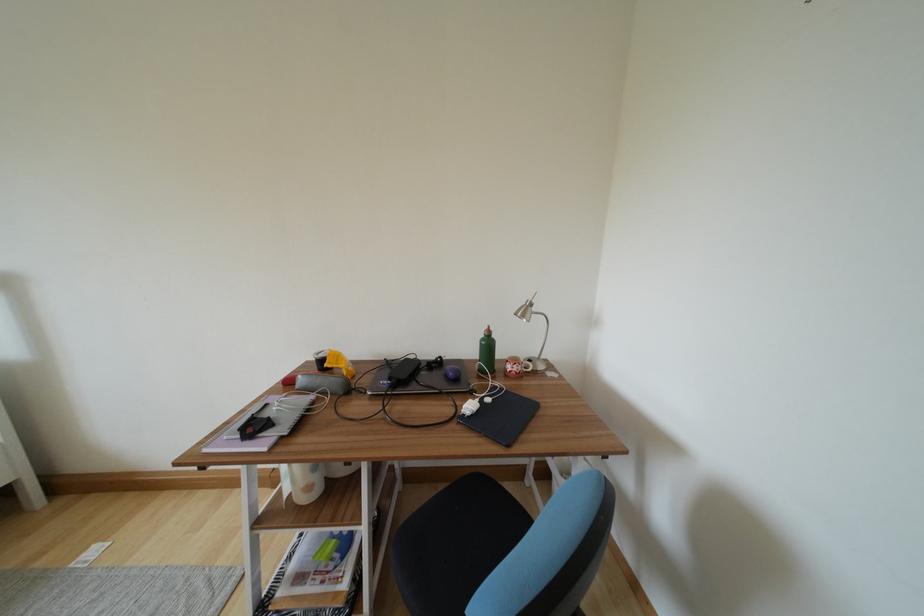
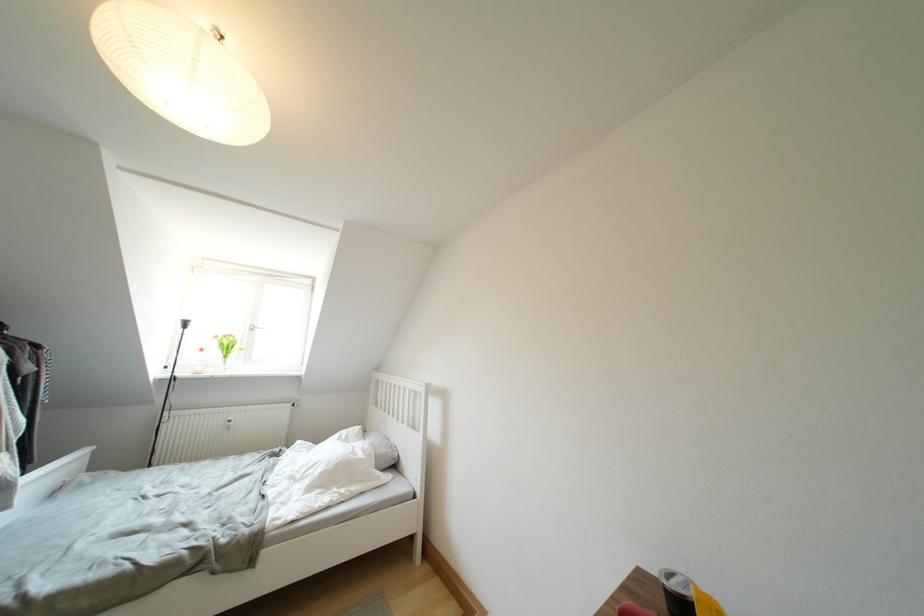
First-person continuous shooting, in which direction is the camera rotating?

The camera rotated toward left-up.